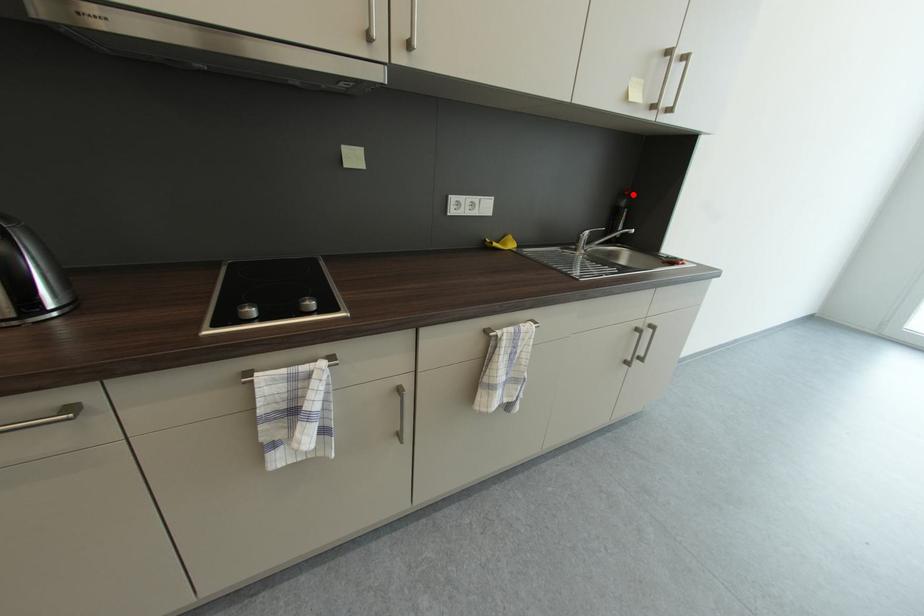
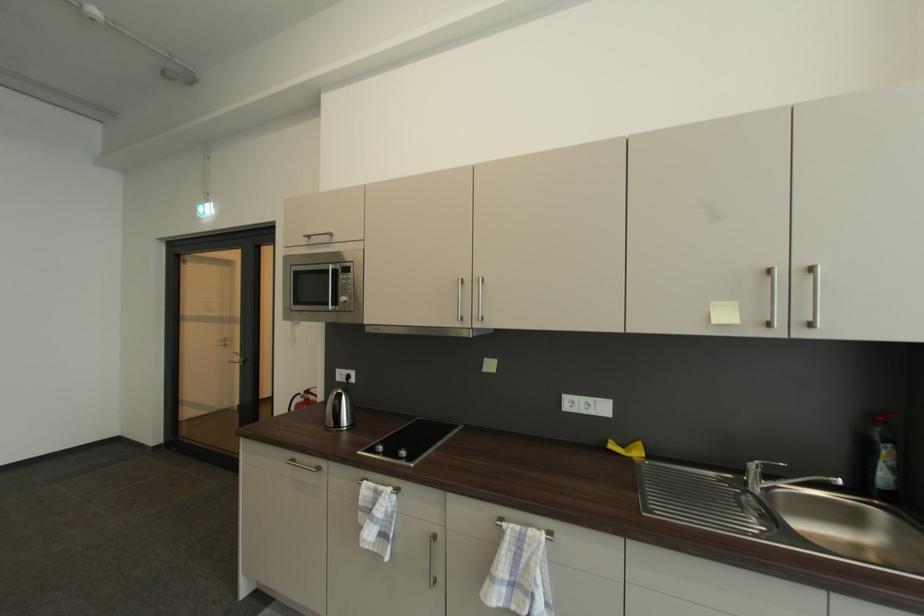
Where in the second image is the point corresponding to the highlighted location from the first image?

(885, 419)